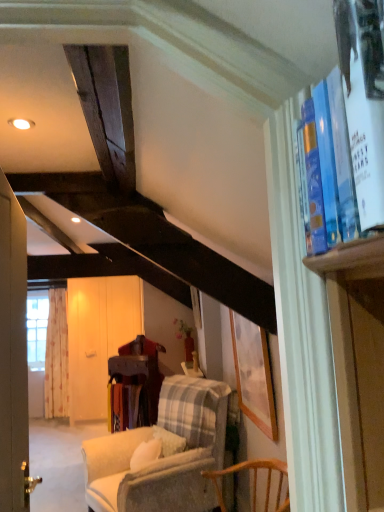
Question: Is plaid fabric chair at center smaller than light beige fabric curtain at left?

Choices:
 (A) no
 (B) yes

Answer: (A)

Question: Considering the relative positions of plaid fabric chair at center and light beige fabric curtain at left in the image provided, is plaid fabric chair at center to the right of light beige fabric curtain at left from the viewer's perspective?

Choices:
 (A) no
 (B) yes

Answer: (B)

Question: Does plaid fabric chair at center have a lesser height compared to light beige fabric curtain at left?

Choices:
 (A) yes
 (B) no

Answer: (A)

Question: Does plaid fabric chair at center come in front of light beige fabric curtain at left?

Choices:
 (A) yes
 (B) no

Answer: (A)

Question: Is plaid fabric chair at center taller than light beige fabric curtain at left?

Choices:
 (A) no
 (B) yes

Answer: (A)

Question: In the image, is matte wooden picture frame at center positioned in front of or behind blue hardcover book at upper right?

Choices:
 (A) behind
 (B) front

Answer: (A)

Question: Considering the positions of matte wooden picture frame at center and blue hardcover book at upper right in the image, is matte wooden picture frame at center bigger or smaller than blue hardcover book at upper right?

Choices:
 (A) small
 (B) big

Answer: (B)

Question: From a real-world perspective, is matte wooden picture frame at center physically located above or below blue hardcover book at upper right?

Choices:
 (A) below
 (B) above

Answer: (A)

Question: Is matte wooden picture frame at center situated inside blue hardcover book at upper right or outside?

Choices:
 (A) inside
 (B) outside

Answer: (B)

Question: In terms of width, does plaid fabric chair at center look wider or thinner when compared to white wood screen door at center?

Choices:
 (A) wide
 (B) thin

Answer: (A)

Question: Is plaid fabric chair at center in front of or behind white wood screen door at center in the image?

Choices:
 (A) behind
 (B) front

Answer: (B)

Question: From the image's perspective, relative to white wood screen door at center, is plaid fabric chair at center above or below?

Choices:
 (A) above
 (B) below

Answer: (B)

Question: Do you think plaid fabric chair at center is within white wood screen door at center, or outside of it?

Choices:
 (A) inside
 (B) outside

Answer: (B)

Question: Is matte wooden picture frame at center wider or thinner than light beige fabric curtain at left?

Choices:
 (A) thin
 (B) wide

Answer: (A)

Question: From a real-world perspective, relative to light beige fabric curtain at left, is matte wooden picture frame at center vertically above or below?

Choices:
 (A) below
 (B) above

Answer: (B)